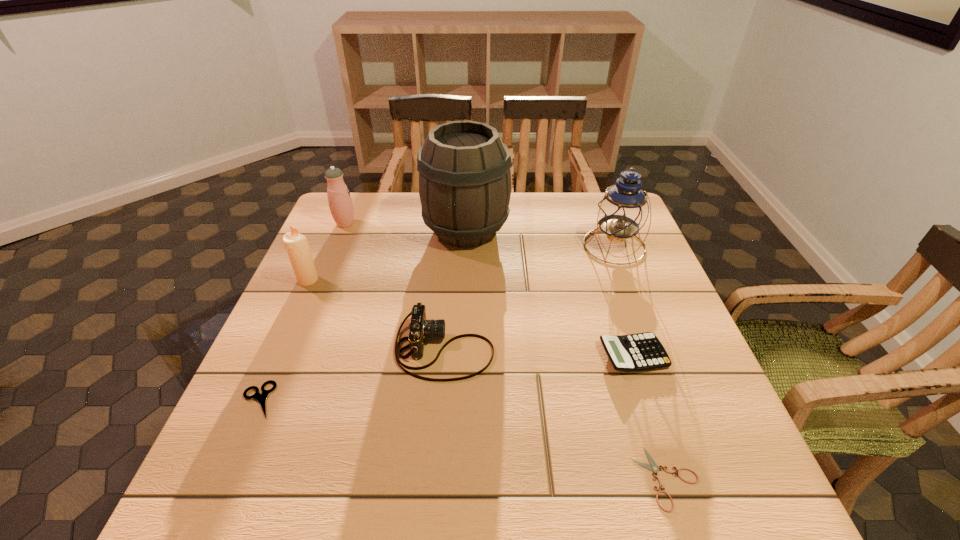
The image size is (960, 540). What are the coordinates of `vacant space located on the left of the tallest object` in the screenshot? It's located at (365, 230).

Find the location of a particular element. This screenshot has width=960, height=540. vacant point located 0.290m on the front-facing side of the lantern is located at coordinates (654, 350).

This screenshot has width=960, height=540. In order to click on free space located on the front of the thermos bottle in this screenshot , I will do `click(333, 253)`.

Locate an element on the screen. The height and width of the screenshot is (540, 960). vacant space located on the front of the candle is located at coordinates (279, 345).

The width and height of the screenshot is (960, 540). I want to click on free space located 0.140m on the front-facing side of the fifth tallest object, so click(x=558, y=348).

Identify the location of free space located 0.370m on the back of the third shortest object. (594, 239).

Where is `blank space located 0.330m on the right of the second shortest object`? This screenshot has height=540, width=960. blank space located 0.330m on the right of the second shortest object is located at coordinates (444, 400).

Locate an element on the screen. This screenshot has width=960, height=540. vacant area situated 0.350m on the left of the shorter shears is located at coordinates (430, 478).

This screenshot has height=540, width=960. I want to click on wine bucket that is at the far edge, so click(x=464, y=167).

Find the location of a particular element. lantern that is at the far edge is located at coordinates (622, 212).